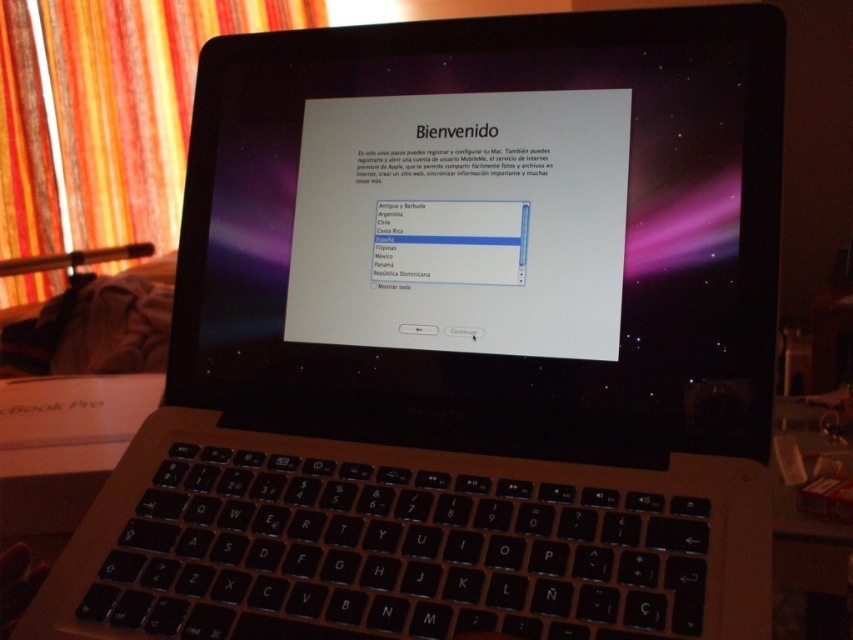
Between orange fabric curtain at left and black plastic keyboard at lower center, which one has less height?

black plastic keyboard at lower center

Based on the photo, who is positioned more to the left, orange fabric curtain at left or black plastic keyboard at lower center?

orange fabric curtain at left

Between point (131, 164) and point (839, 392), which one is positioned in front?

Point (839, 392) is in front.

Identify the location of orange fabric curtain at left. The height and width of the screenshot is (640, 853). (136, 102).